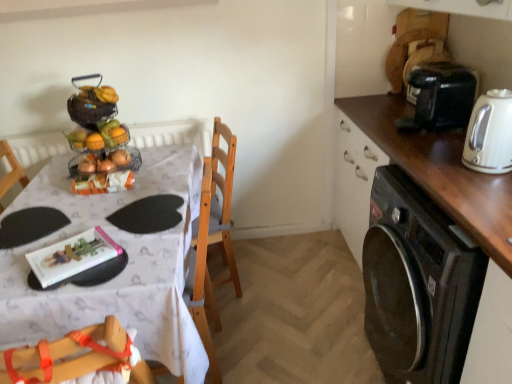
Question: Is wire mesh basket at center taller or shorter than metallic wire fruit stand at upper left?

Choices:
 (A) tall
 (B) short

Answer: (B)

Question: In terms of width, does wire mesh basket at center look wider or thinner when compared to metallic wire fruit stand at upper left?

Choices:
 (A) wide
 (B) thin

Answer: (B)

Question: Which is nearer to the wooden chair at center, the second chair viewed from the front?

Choices:
 (A) shiny metallic fruit basket at upper left
 (B) metallic wire fruit stand at upper left
 (C) white glossy table at upper left
 (D) white glossy electric kettle at right
 (E) black glossy dishwasher at lower right

Answer: (C)

Question: Which of these objects is positioned closest to the black glossy dishwasher at lower right?

Choices:
 (A) white glossy electric kettle at right
 (B) white glossy table at upper left
 (C) wooden chair at center, which ranks as the 1th chair in back-to-front order
 (D) wooden chair at lower left, arranged as the 2th chair when viewed from the back
 (E) black plastic coffee machine at upper right

Answer: (A)